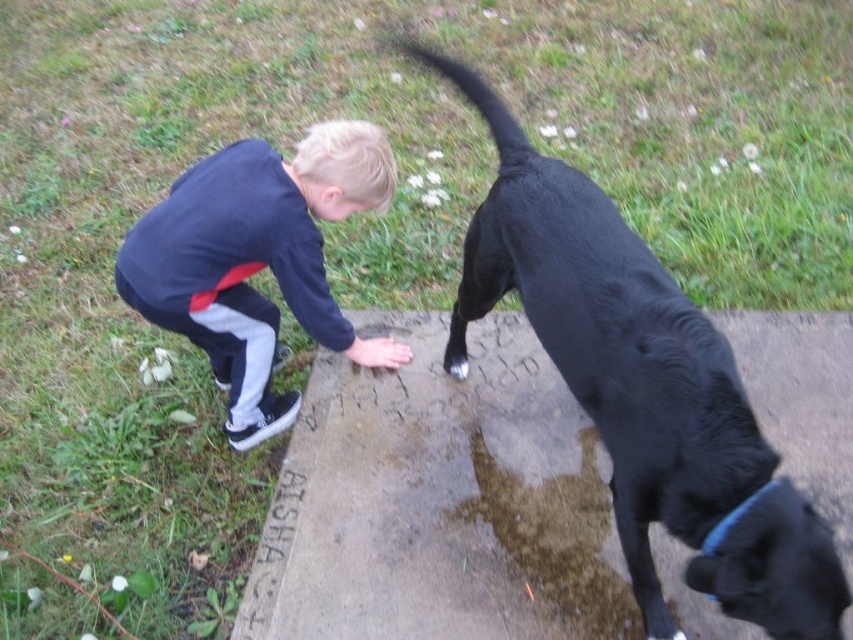
Question: Does black smooth dog at lower right appear over dark blue sweatshirt at center?

Choices:
 (A) yes
 (B) no

Answer: (B)

Question: Which point appears closest to the camera in this image?

Choices:
 (A) (788, 518)
 (B) (323, 272)

Answer: (A)

Question: Is black smooth dog at lower right closer to camera compared to dark blue sweatshirt at center?

Choices:
 (A) no
 (B) yes

Answer: (B)

Question: Is black smooth dog at lower right thinner than dark blue sweatshirt at center?

Choices:
 (A) no
 (B) yes

Answer: (B)

Question: Which object appears closest to the camera in this image?

Choices:
 (A) dark blue sweatshirt at center
 (B) black smooth dog at lower right

Answer: (B)